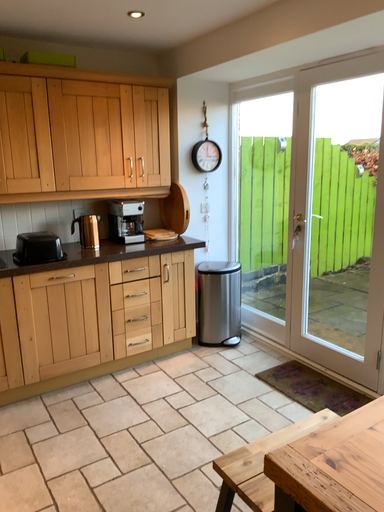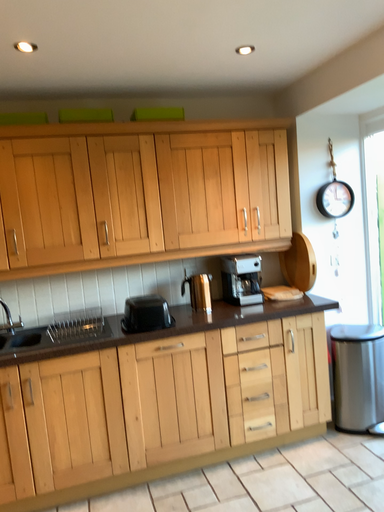
Question: Which way did the camera rotate in the video?

Choices:
 (A) rotated right
 (B) rotated left

Answer: (B)